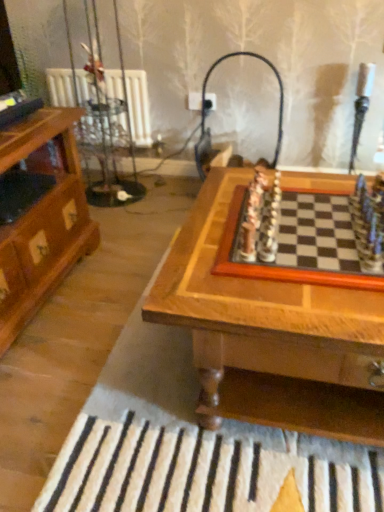
Question: Is wooden chessboard at center bigger than wooden chessboard at center?

Choices:
 (A) no
 (B) yes

Answer: (B)

Question: Considering the relative sizes of wooden chessboard at center and wooden chessboard at center in the image provided, is wooden chessboard at center wider than wooden chessboard at center?

Choices:
 (A) no
 (B) yes

Answer: (B)

Question: Is wooden chessboard at center to the right of wooden chessboard at center from the viewer's perspective?

Choices:
 (A) no
 (B) yes

Answer: (A)

Question: Is wooden chessboard at center far from wooden chessboard at center?

Choices:
 (A) no
 (B) yes

Answer: (A)

Question: Does wooden chessboard at center appear on the left side of wooden chessboard at center?

Choices:
 (A) no
 (B) yes

Answer: (B)

Question: Considering the relative sizes of wooden chessboard at center and wooden chessboard at center in the image provided, is wooden chessboard at center taller than wooden chessboard at center?

Choices:
 (A) no
 (B) yes

Answer: (B)

Question: Does wooden chessboard at center have a greater width compared to wooden chessboard at center?

Choices:
 (A) no
 (B) yes

Answer: (A)

Question: Is wooden chessboard at center at the right side of wooden chessboard at center?

Choices:
 (A) yes
 (B) no

Answer: (A)

Question: Considering the relative sizes of wooden chessboard at center and wooden chessboard at center in the image provided, is wooden chessboard at center shorter than wooden chessboard at center?

Choices:
 (A) yes
 (B) no

Answer: (A)

Question: Does wooden chessboard at center have a larger size compared to wooden chessboard at center?

Choices:
 (A) yes
 (B) no

Answer: (B)

Question: From the image's perspective, is wooden chessboard at center over wooden chessboard at center?

Choices:
 (A) yes
 (B) no

Answer: (A)

Question: Considering the relative positions of wooden chessboard at center and wooden chessboard at center in the image provided, is wooden chessboard at center to the left of wooden chessboard at center from the viewer's perspective?

Choices:
 (A) yes
 (B) no

Answer: (B)

Question: Is matte black lamp at upper center to the right of wooden chessboard at center from the viewer's perspective?

Choices:
 (A) yes
 (B) no

Answer: (B)